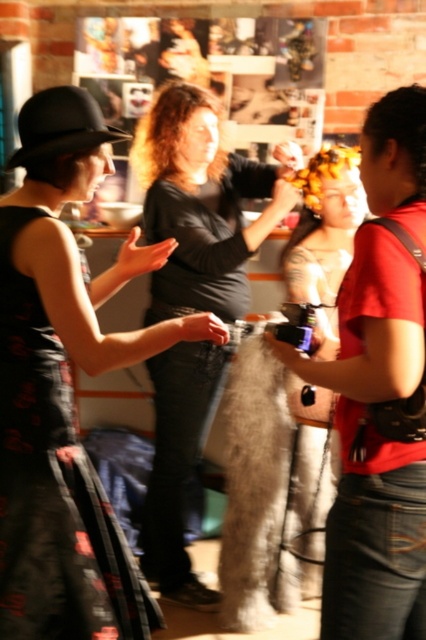
Question: Does black fuzzy coat at center have a smaller size compared to black textured dress at left?

Choices:
 (A) no
 (B) yes

Answer: (A)

Question: Is black fuzzy coat at center to the left of black textured dress at left from the viewer's perspective?

Choices:
 (A) yes
 (B) no

Answer: (B)

Question: From the image, what is the correct spatial relationship of black fuzzy coat at center in relation to black textured dress at left?

Choices:
 (A) below
 (B) above

Answer: (B)

Question: Which point is farther to the camera?

Choices:
 (A) black textured dress at left
 (B) black fuzzy coat at center

Answer: (B)

Question: Which of the following is the farthest from the observer?

Choices:
 (A) (94, 566)
 (B) (221, 211)

Answer: (B)